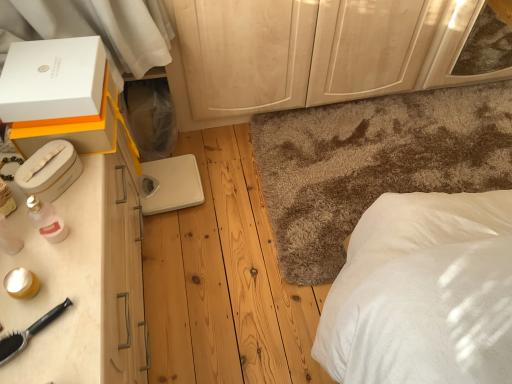
The height and width of the screenshot is (384, 512). I want to click on vacant space in front of white plastic scale at center, so click(178, 234).